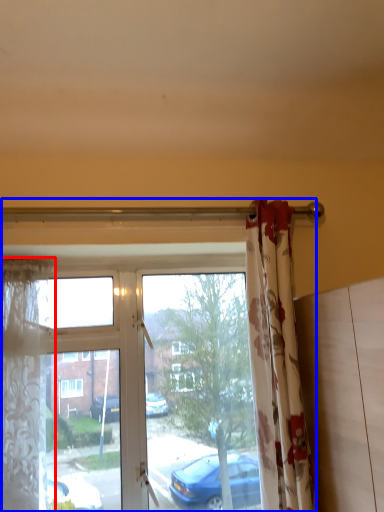
Question: Which object appears farthest to the camera in this image, curtain (highlighted by a red box) or window (highlighted by a blue box)?

Choices:
 (A) curtain
 (B) window

Answer: (B)